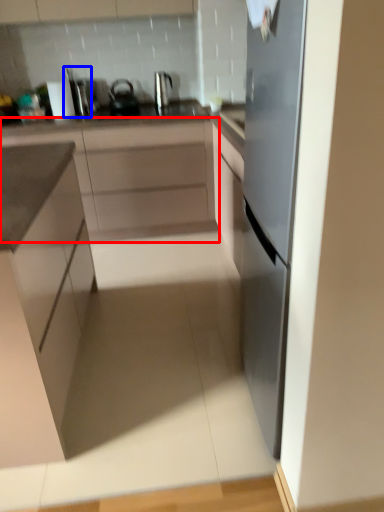
Question: Among these objects, which one is nearest to the camera, cabinetry (highlighted by a red box) or appliance (highlighted by a blue box)?

Choices:
 (A) cabinetry
 (B) appliance

Answer: (A)